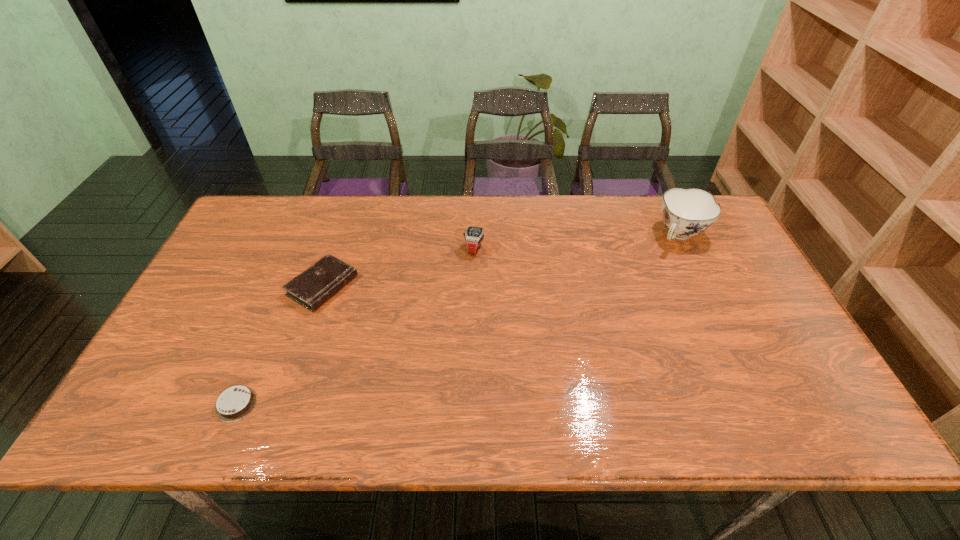
What are the coordinates of `the rightmost object` in the screenshot? It's located at (686, 212).

Where is `the tallest object`? The height and width of the screenshot is (540, 960). the tallest object is located at coordinates (686, 212).

At what (x,y) coordinates should I click in order to perform the action: click on watch. Please return your answer as a coordinate pair (x, y). This screenshot has height=540, width=960. Looking at the image, I should click on (474, 236).

Find the location of `the third shortest object`. the third shortest object is located at coordinates click(x=474, y=236).

Where is `diary`? The width and height of the screenshot is (960, 540). diary is located at coordinates (313, 287).

Locate an element on the screen. The image size is (960, 540). the second nearest object is located at coordinates (313, 287).

I want to click on chocolate cake, so click(235, 403).

This screenshot has height=540, width=960. In order to click on the nearest object in this screenshot , I will do `click(235, 403)`.

This screenshot has height=540, width=960. I want to click on vacant position located on the left of the chinaware, so click(623, 235).

The height and width of the screenshot is (540, 960). What are the coordinates of `vacant space located on the front of the third object from left to right` in the screenshot? It's located at (472, 355).